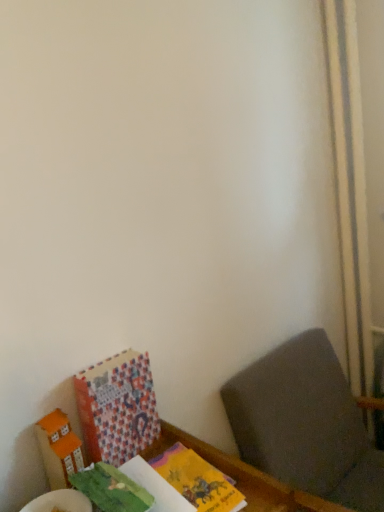
Question: Does orange matte cardboard box at lower left have a larger size compared to wooden table at lower left?

Choices:
 (A) yes
 (B) no

Answer: (B)

Question: Is orange matte cardboard box at lower left aimed at wooden table at lower left?

Choices:
 (A) yes
 (B) no

Answer: (B)

Question: Does orange matte cardboard box at lower left have a smaller size compared to wooden table at lower left?

Choices:
 (A) yes
 (B) no

Answer: (A)

Question: Is orange matte cardboard box at lower left positioned before wooden table at lower left?

Choices:
 (A) yes
 (B) no

Answer: (B)

Question: Does orange matte cardboard box at lower left appear on the left side of wooden table at lower left?

Choices:
 (A) no
 (B) yes

Answer: (B)

Question: Is patterned paper book at lower left inside or outside of wooden table at lower left?

Choices:
 (A) inside
 (B) outside

Answer: (B)

Question: Looking at their shapes, would you say patterned paper book at lower left is wider or thinner than wooden table at lower left?

Choices:
 (A) thin
 (B) wide

Answer: (A)

Question: Is patterned paper book at lower left bigger or smaller than wooden table at lower left?

Choices:
 (A) small
 (B) big

Answer: (A)

Question: Is patterned paper book at lower left to the left or to the right of wooden table at lower left in the image?

Choices:
 (A) left
 (B) right

Answer: (A)

Question: Is wooden table at lower left in front of or behind dark gray fabric at lower right in the image?

Choices:
 (A) behind
 (B) front

Answer: (B)

Question: In terms of size, does wooden table at lower left appear bigger or smaller than dark gray fabric at lower right?

Choices:
 (A) small
 (B) big

Answer: (A)

Question: From the image's perspective, relative to dark gray fabric at lower right, is wooden table at lower left above or below?

Choices:
 (A) above
 (B) below

Answer: (A)

Question: Looking at their shapes, would you say wooden table at lower left is wider or thinner than dark gray fabric at lower right?

Choices:
 (A) thin
 (B) wide

Answer: (A)

Question: In terms of width, does dark gray fabric at lower right look wider or thinner when compared to wooden table at lower left?

Choices:
 (A) thin
 (B) wide

Answer: (B)

Question: From a real-world perspective, relative to wooden table at lower left, is dark gray fabric at lower right vertically above or below?

Choices:
 (A) above
 (B) below

Answer: (B)